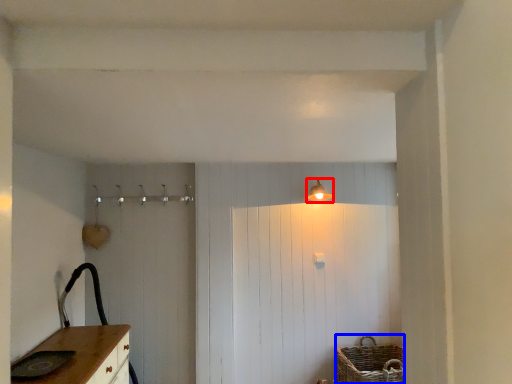
Question: Which point is further to the camera, light fixture (highlighted by a red box) or basket (highlighted by a blue box)?

Choices:
 (A) light fixture
 (B) basket

Answer: (A)